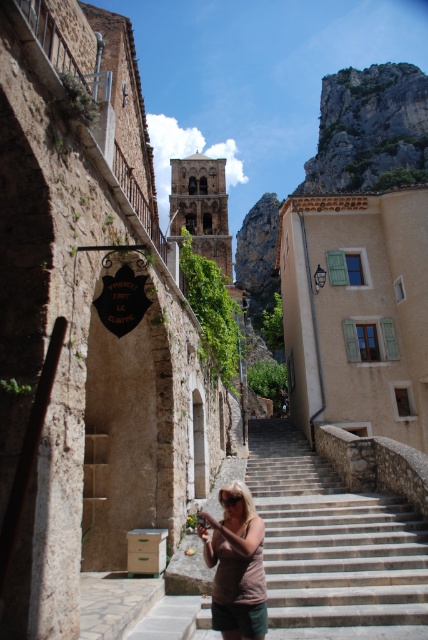
You are a tourist in the village and want to climb the smooth stone stairs at center. You notice a brown cotton shirt at center nearby. Which object is taller between the two?

The brown cotton shirt at center is taller than the smooth stone stairs at center.

You are a tourist in a Mediterranean village and you see the smooth stone stairs at center and the brown cotton shirt at center. Which object is located to the right of the other?

The smooth stone stairs at center is positioned on the right side of brown cotton shirt at center.

You are a tourist standing at the bottom of the smooth stone stairs at center and want to reach the brown cotton shirt at center. Which direction should you move to get closer to the shirt?

The smooth stone stairs at center is further to the viewer than the brown cotton shirt at center, so you should move forward away from the stairs towards the shirt.